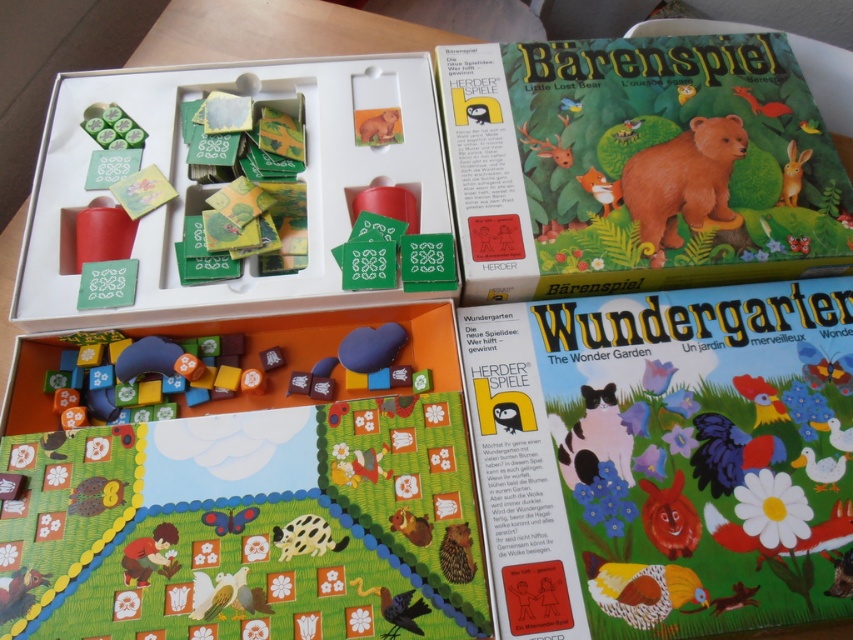
Question: Can you confirm if wooden bear at upper right is bigger than black and white fur cat at lower center?

Choices:
 (A) no
 (B) yes

Answer: (B)

Question: Which point appears closest to the camera in this image?

Choices:
 (A) (521, 141)
 (B) (151, 122)
 (C) (531, 468)

Answer: (C)

Question: Can you confirm if shiny black bird at lower center is wider than orange matte rabbit at upper right?

Choices:
 (A) yes
 (B) no

Answer: (A)

Question: Which object is farther from the camera taking this photo?

Choices:
 (A) brown furry squirrel at center
 (B) wooden squirrel at lower left

Answer: (A)

Question: Which point is farther to the camera?

Choices:
 (A) brown furry hedgehog at lower center
 (B) black and white fur cat at lower center
 (C) brown matte deer at upper center
 (D) brown furry squirrel at center

Answer: (C)

Question: Can you confirm if brown furry bear at upper center is wider than brown furry squirrel at center?

Choices:
 (A) no
 (B) yes

Answer: (B)